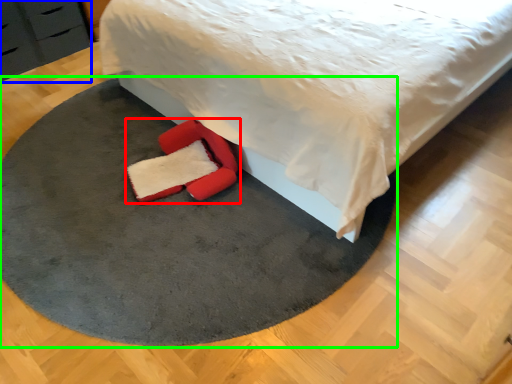
Question: Which object is the farthest from footwear (highlighted by a red box)? Choose among these: dresser (highlighted by a blue box) or mat (highlighted by a green box).

Choices:
 (A) dresser
 (B) mat

Answer: (A)